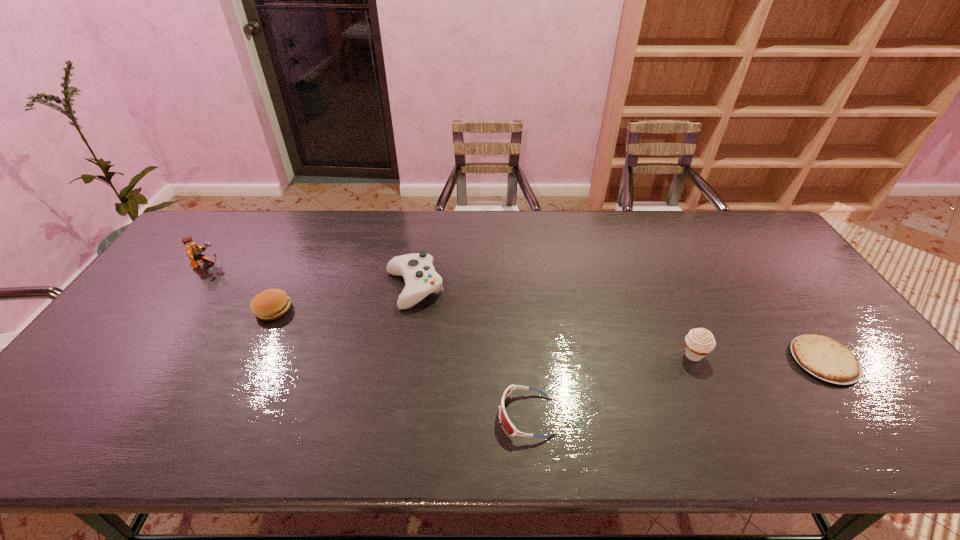
Locate an element on the screen. free area in between the nearest object and the third object from left to right is located at coordinates (470, 352).

At what (x,y) coordinates should I click in order to perform the action: click on free area in between the nearest object and the control. Please return your answer as a coordinate pair (x, y). This screenshot has width=960, height=540. Looking at the image, I should click on (470, 352).

Find the location of a particular element. free space between the tortilla and the goggles is located at coordinates click(675, 388).

You are a GUI agent. You are given a task and a screenshot of the screen. Output one action in this format:
    pyautogui.click(x=<x>, y=<y>)
    Task: Click on the empty space that is in between the shortest object and the patty
    
    Given the screenshot: What is the action you would take?
    pyautogui.click(x=548, y=335)

Identify the location of vacant region between the goggles and the fifth object from right to left. (399, 363).

The image size is (960, 540). Find the location of `free space between the control and the fifth object from left to right`. free space between the control and the fifth object from left to right is located at coordinates (554, 322).

Locate an element on the screen. The image size is (960, 540). vacant region between the fourth object from right to left and the muffin is located at coordinates (554, 322).

Identify the location of object that is the fifth closest to the fifth object from left to right. The width and height of the screenshot is (960, 540). (193, 250).

Where is `object that is the second closest to the patty`? The height and width of the screenshot is (540, 960). object that is the second closest to the patty is located at coordinates (421, 279).

You are a GUI agent. You are given a task and a screenshot of the screen. Output one action in this format:
    pyautogui.click(x=<x>, y=<y>)
    Task: Click on the vacant position in the image that satisfies the following two spatial constraints: 1. holding a crossbow in the hands of the fifth object from left to right; 2. on the right side of the Lego
    The image size is (960, 540).
    Given the screenshot: What is the action you would take?
    pyautogui.click(x=144, y=355)